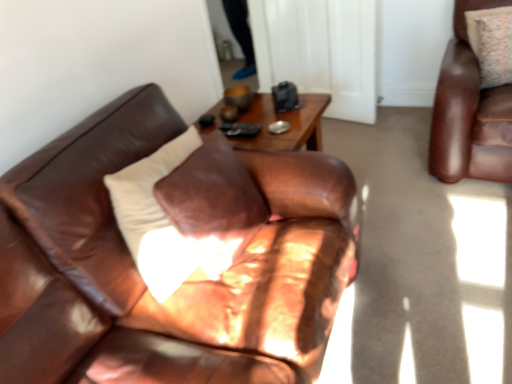
At what (x,y) coordinates should I click in order to perform the action: click on free space in front of transparent glass door at upper center. Please return your answer as a coordinate pair (x, y). Image resolution: width=512 pixels, height=384 pixels. Looking at the image, I should click on (378, 154).